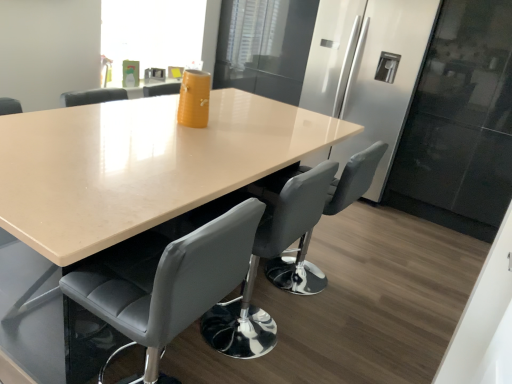
Question: Does sleek stainless steel fridge at center turn towards gray leather chair at center, the 1th chair viewed from the front?

Choices:
 (A) no
 (B) yes

Answer: (B)

Question: Are sleek stainless steel fridge at center and gray leather chair at center, the 1th chair viewed from the front, beside each other?

Choices:
 (A) yes
 (B) no

Answer: (B)

Question: Does sleek stainless steel fridge at center have a smaller size compared to gray leather chair at center, the second chair viewed from the back?

Choices:
 (A) no
 (B) yes

Answer: (A)

Question: Is sleek stainless steel fridge at center positioned with its back to gray leather chair at center, the second chair viewed from the back?

Choices:
 (A) yes
 (B) no

Answer: (B)

Question: Is sleek stainless steel fridge at center wider than gray leather chair at center, the 1th chair viewed from the front?

Choices:
 (A) no
 (B) yes

Answer: (B)

Question: Looking at the image, does beige glossy table at center seem bigger or smaller compared to gray leather chair at center, the 1th chair viewed from the front?

Choices:
 (A) small
 (B) big

Answer: (B)

Question: Does point click(142, 124) appear closer or farther from the camera than point click(94, 276)?

Choices:
 (A) farther
 (B) closer

Answer: (A)

Question: In the image, is beige glossy table at center positioned in front of or behind gray leather chair at center, the second chair viewed from the back?

Choices:
 (A) front
 (B) behind

Answer: (A)

Question: In terms of height, does beige glossy table at center look taller or shorter compared to gray leather chair at center, the second chair viewed from the back?

Choices:
 (A) tall
 (B) short

Answer: (B)

Question: From the image's perspective, relative to transparent glass window screen at upper center, is sleek stainless steel fridge at center above or below?

Choices:
 (A) above
 (B) below

Answer: (B)

Question: Is sleek stainless steel fridge at center in front of or behind transparent glass window screen at upper center in the image?

Choices:
 (A) behind
 (B) front

Answer: (B)

Question: Is sleek stainless steel fridge at center inside or outside of transparent glass window screen at upper center?

Choices:
 (A) outside
 (B) inside

Answer: (A)

Question: Based on their sizes in the image, would you say sleek stainless steel fridge at center is bigger or smaller than transparent glass window screen at upper center?

Choices:
 (A) small
 (B) big

Answer: (B)

Question: From the image's perspective, is gray leather chair at center, the first chair in the back-to-front sequence, located above or below sleek stainless steel fridge at center?

Choices:
 (A) below
 (B) above

Answer: (A)

Question: Is point (301, 182) closer or farther from the camera than point (376, 8)?

Choices:
 (A) farther
 (B) closer

Answer: (B)